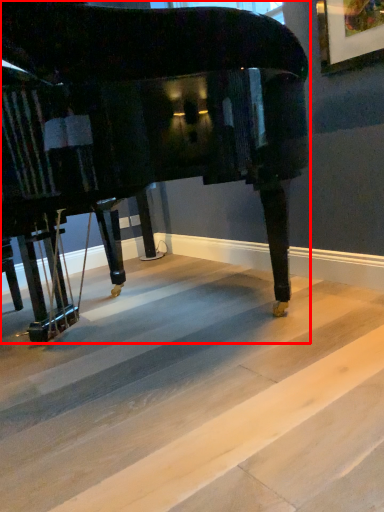
Question: From the image's perspective, considering the relative positions of piano (annotated by the red box) and concrete in the image provided, where is piano (annotated by the red box) located with respect to the staircase?

Choices:
 (A) below
 (B) above

Answer: (B)